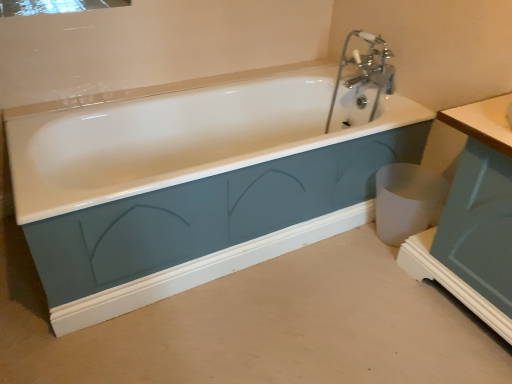
You are a GUI agent. You are given a task and a screenshot of the screen. Output one action in this format:
    pyautogui.click(x=<x>, y=<y>)
    Task: Click on the vacant area that lies in front of white glossy bathtub at center
    This screenshot has width=512, height=384.
    Given the screenshot: What is the action you would take?
    pyautogui.click(x=240, y=323)